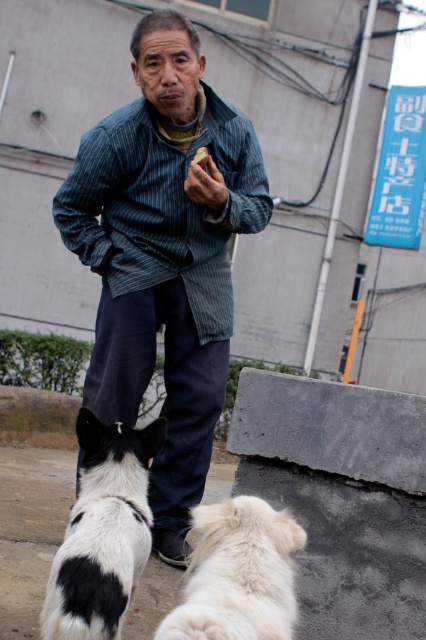
Question: Where is striped fabric jacket at center located in relation to white fluffy dog at lower center in the image?

Choices:
 (A) right
 (B) left

Answer: (B)

Question: Which point is closer to the camera?

Choices:
 (A) black-and-white fur dog at lower left
 (B) striped fabric jacket at center
 (C) white fluffy dog at lower center

Answer: (C)

Question: Which of the following is the closest to the observer?

Choices:
 (A) (157, 424)
 (B) (276, 545)
 (C) (172, 444)

Answer: (B)

Question: Does striped fabric jacket at center appear on the right side of white fluffy dog at lower center?

Choices:
 (A) yes
 (B) no

Answer: (B)

Question: Considering the real-world distances, which object is farthest from the striped fabric jacket at center?

Choices:
 (A) white fluffy dog at lower center
 (B) black-and-white fur dog at lower left

Answer: (A)

Question: Does striped fabric jacket at center appear on the left side of black-and-white fur dog at lower left?

Choices:
 (A) no
 (B) yes

Answer: (A)